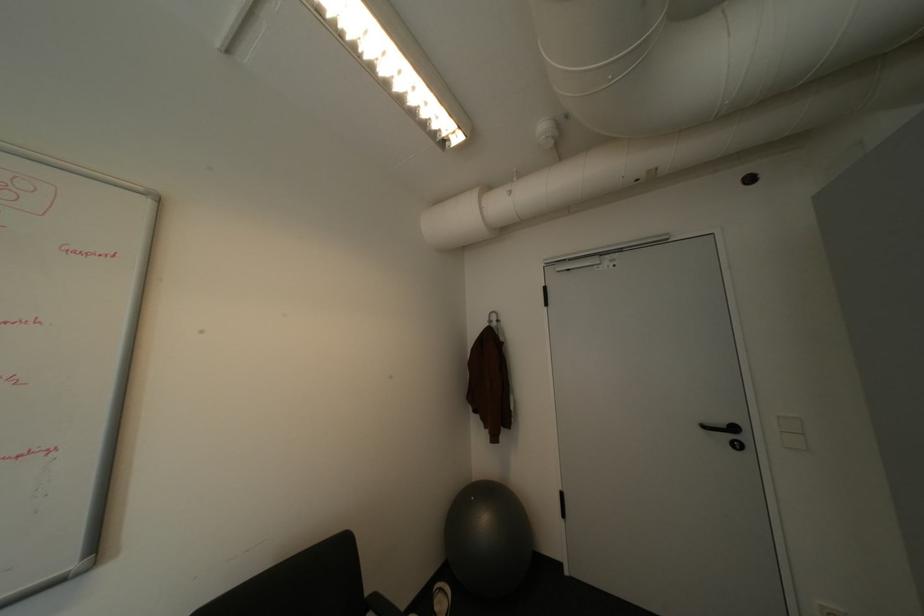
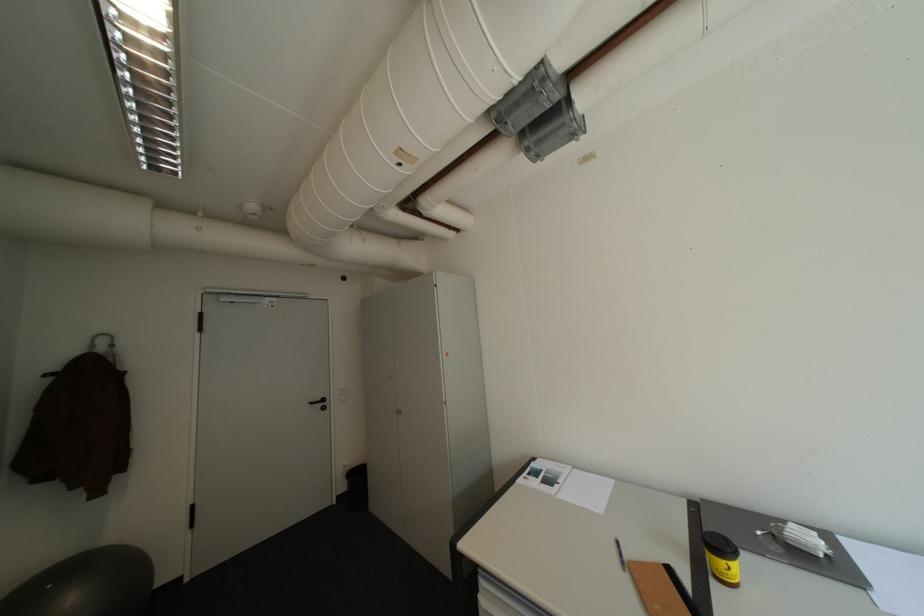
Where in the second image is the point corresponding to [714,427] from the first image?

(321, 403)